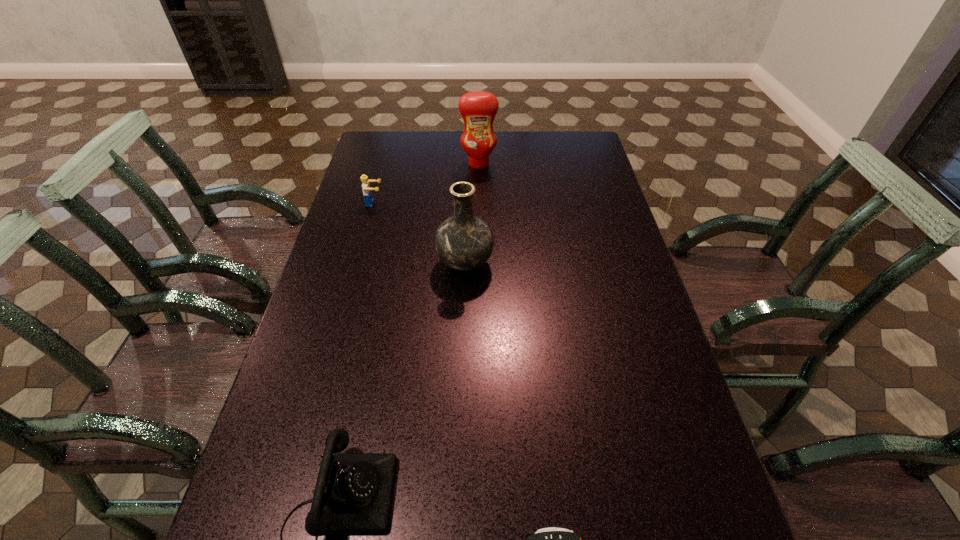
Find the location of a particular element. vacant space at the right edge is located at coordinates (720, 515).

The width and height of the screenshot is (960, 540). What are the coordinates of `vacant position at the far left corner of the desktop` in the screenshot? It's located at (394, 157).

At what (x,y) coordinates should I click in order to perform the action: click on vacant space at the far right corner of the desktop. Please return your answer as a coordinate pair (x, y). Image resolution: width=960 pixels, height=540 pixels. Looking at the image, I should click on (587, 162).

At what (x,y) coordinates should I click in order to perform the action: click on vacant area between the condiment and the fourth nearest object. Please return your answer as a coordinate pair (x, y). This screenshot has height=540, width=960. Looking at the image, I should click on (426, 184).

What are the coordinates of `empty space between the farthest object and the Lego` in the screenshot? It's located at pos(426,184).

I want to click on object identified as the second closest to the farthest object, so click(x=463, y=242).

The width and height of the screenshot is (960, 540). In order to click on object that stands as the second closest to the telephone in this screenshot , I will do `click(463, 242)`.

I want to click on free region that satisfies the following two spatial constraints: 1. on the back side of the vase; 2. on the face of the second farthest object, so click(467, 203).

Locate an element on the screen. The image size is (960, 540). free spot that satisfies the following two spatial constraints: 1. on the face of the vase; 2. on the right side of the Lego is located at coordinates (358, 264).

Locate an element on the screen. This screenshot has height=540, width=960. free spot that satisfies the following two spatial constraints: 1. on the face of the vase; 2. on the right side of the Lego is located at coordinates (358, 264).